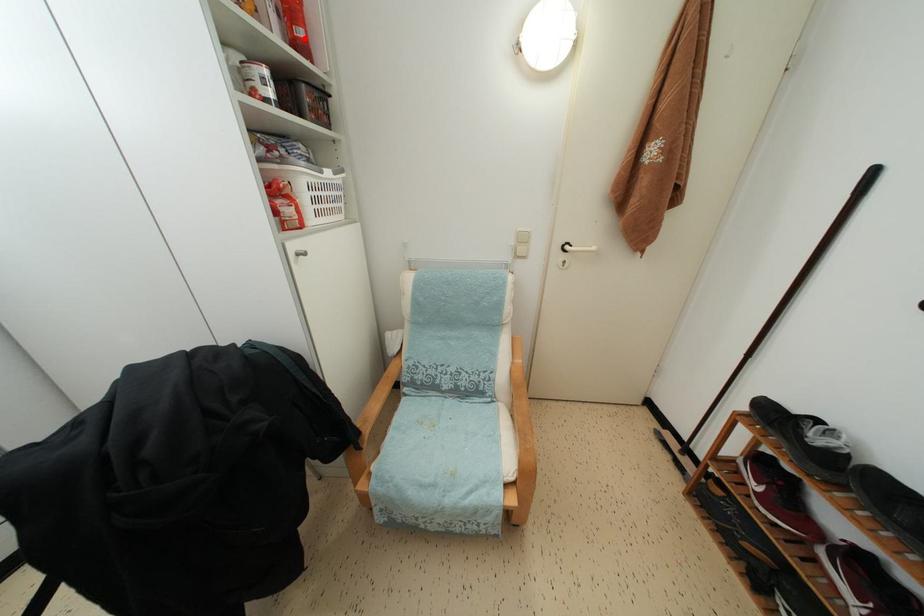
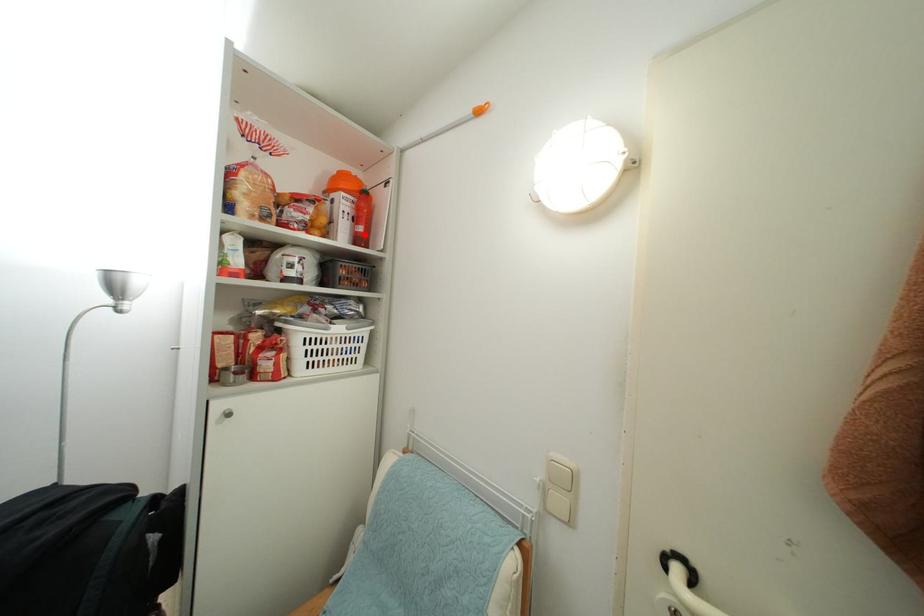
I am providing you with two images of the same scene from different viewpoints. A red point is marked on the first image and another point is marked on the second image. Does the point marked in image1 correspond to the same location as the one in image2?

Yes